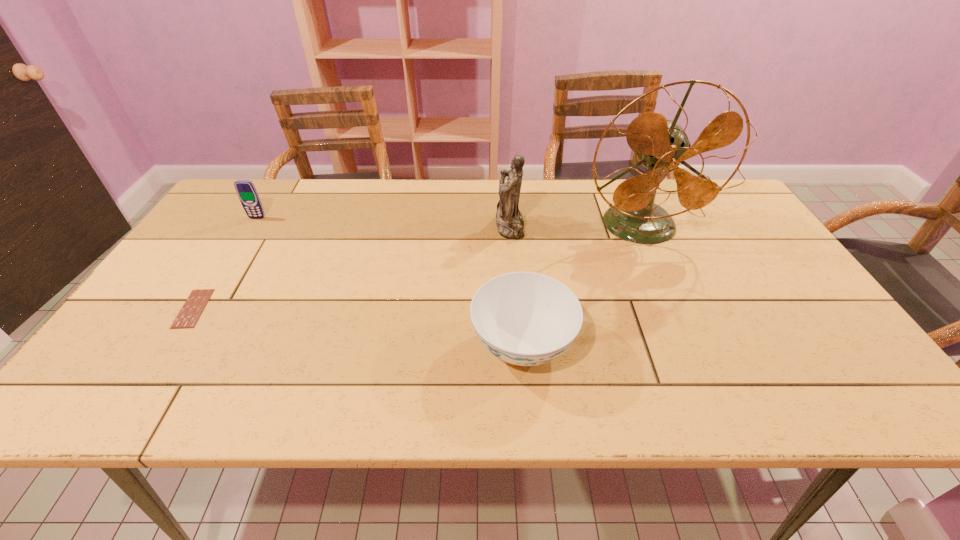
The width and height of the screenshot is (960, 540). Identify the location of vacant region located on the front-facing side of the cellular telephone. (228, 265).

I want to click on vacant space located 0.160m on the right of the chinaware, so click(x=646, y=346).

The height and width of the screenshot is (540, 960). I want to click on free space located on the back of the shortest object, so click(x=236, y=242).

You are a GUI agent. You are given a task and a screenshot of the screen. Output one action in this format:
    pyautogui.click(x=<x>, y=<y>)
    Task: Click on the fan that is at the far edge
    This screenshot has width=960, height=540.
    Given the screenshot: What is the action you would take?
    pyautogui.click(x=661, y=145)

Find the location of a particular element. This screenshot has height=540, width=960. figurine present at the far edge is located at coordinates [x=509, y=220].

Where is `cellular telephone present at the far edge`? The height and width of the screenshot is (540, 960). cellular telephone present at the far edge is located at coordinates (246, 191).

Identify the location of object present at the near edge. (524, 318).

The image size is (960, 540). I want to click on cellular telephone that is positioned at the left edge, so click(x=246, y=191).

Locate an element on the screen. The height and width of the screenshot is (540, 960). chocolate bar present at the left edge is located at coordinates (192, 309).

The width and height of the screenshot is (960, 540). I want to click on object present at the right edge, so click(661, 145).